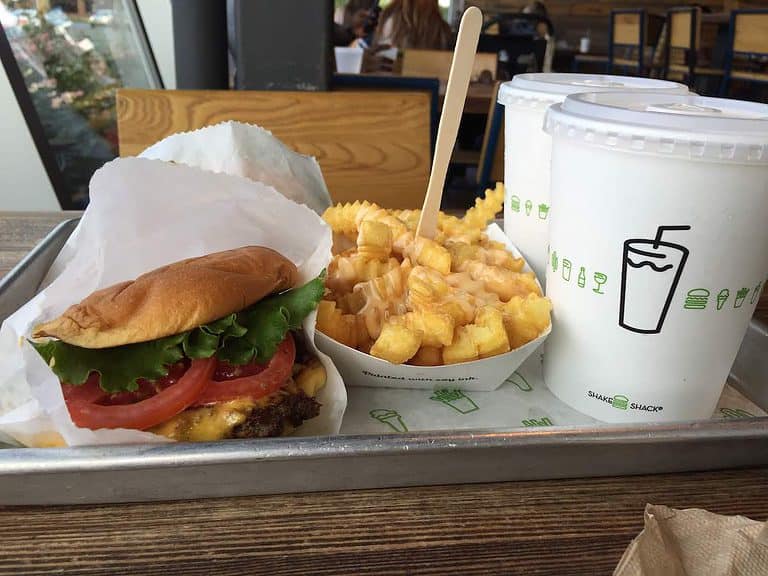
This screenshot has width=768, height=576. I want to click on cup, so click(584, 185), click(531, 166).